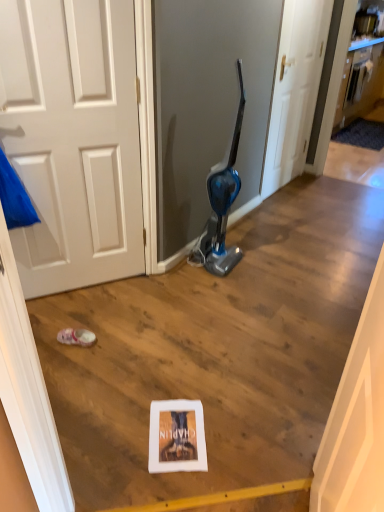
Question: From the image's perspective, would you say white matte door at center is positioned over wooden cabinet at upper right?

Choices:
 (A) yes
 (B) no

Answer: (B)

Question: Is there a large distance between white matte door at center and wooden cabinet at upper right?

Choices:
 (A) no
 (B) yes

Answer: (B)

Question: Can you confirm if white matte door at center is bigger than wooden cabinet at upper right?

Choices:
 (A) yes
 (B) no

Answer: (A)

Question: From a real-world perspective, is white matte door at center beneath wooden cabinet at upper right?

Choices:
 (A) no
 (B) yes

Answer: (B)

Question: Is white matte door at center to the left of wooden cabinet at upper right from the viewer's perspective?

Choices:
 (A) yes
 (B) no

Answer: (A)

Question: Looking at their shapes, would you say pink fabric shoe at lower left is wider or thinner than white matte door at center?

Choices:
 (A) wide
 (B) thin

Answer: (A)

Question: Would you say pink fabric shoe at lower left is inside or outside white matte door at center?

Choices:
 (A) outside
 (B) inside

Answer: (A)

Question: In terms of size, does pink fabric shoe at lower left appear bigger or smaller than white matte door at center?

Choices:
 (A) big
 (B) small

Answer: (B)

Question: In terms of height, does pink fabric shoe at lower left look taller or shorter compared to white matte door at center?

Choices:
 (A) short
 (B) tall

Answer: (A)

Question: From a real-world perspective, is pink fabric shoe at lower left above or below wooden cabinet at upper right?

Choices:
 (A) below
 (B) above

Answer: (A)

Question: From their relative heights in the image, would you say pink fabric shoe at lower left is taller or shorter than wooden cabinet at upper right?

Choices:
 (A) tall
 (B) short

Answer: (B)

Question: Relative to wooden cabinet at upper right, is pink fabric shoe at lower left in front or behind?

Choices:
 (A) behind
 (B) front

Answer: (B)

Question: Is pink fabric shoe at lower left inside the boundaries of wooden cabinet at upper right, or outside?

Choices:
 (A) inside
 (B) outside

Answer: (B)

Question: In the image, is wooden cabinet at upper right on the left side or the right side of white matte door at center?

Choices:
 (A) left
 (B) right

Answer: (B)

Question: From a real-world perspective, is wooden cabinet at upper right physically located above or below white matte door at center?

Choices:
 (A) above
 (B) below

Answer: (A)